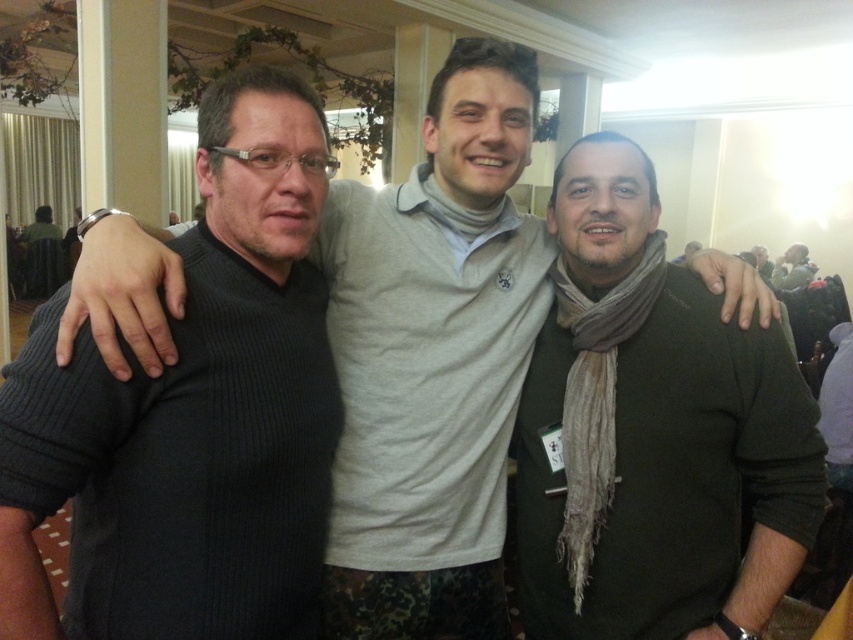
Who is more distant from viewer, (48, 410) or (538, 387)?

Point (538, 387)

Is ribbed sweater at left wider than dark green sweater at center?

Incorrect, ribbed sweater at left's width does not surpass dark green sweater at center's.

This screenshot has height=640, width=853. In order to click on ribbed sweater at left in this screenshot , I will do pyautogui.click(x=192, y=413).

Where is `ribbed sweater at left`? ribbed sweater at left is located at coordinates (192, 413).

Is ribbed sweater at left positioned before green textured scarf at center?

Yes, ribbed sweater at left is closer to the viewer.

Which is above, ribbed sweater at left or green textured scarf at center?

green textured scarf at center is higher up.

Is point (286, 531) in front of point (802, 260)?

Yes, it is.

This screenshot has width=853, height=640. I want to click on ribbed sweater at left, so click(x=192, y=413).

Between dark green sweater at center and green textured scarf at center, which one is positioned higher?

green textured scarf at center

In the scene shown: Is dark green sweater at center thinner than green textured scarf at center?

Correct, dark green sweater at center's width is less than green textured scarf at center's.

Locate an element on the screen. dark green sweater at center is located at coordinates (653, 433).